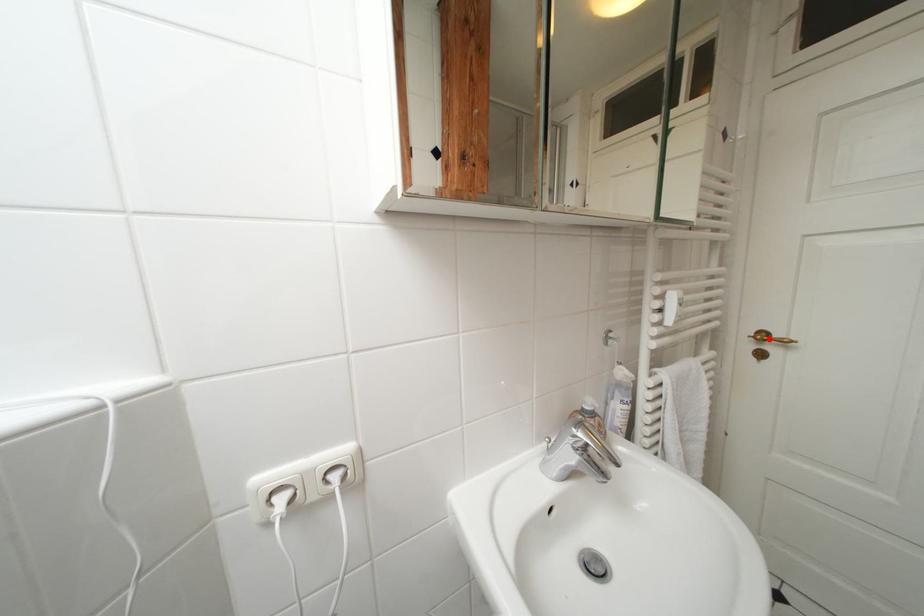
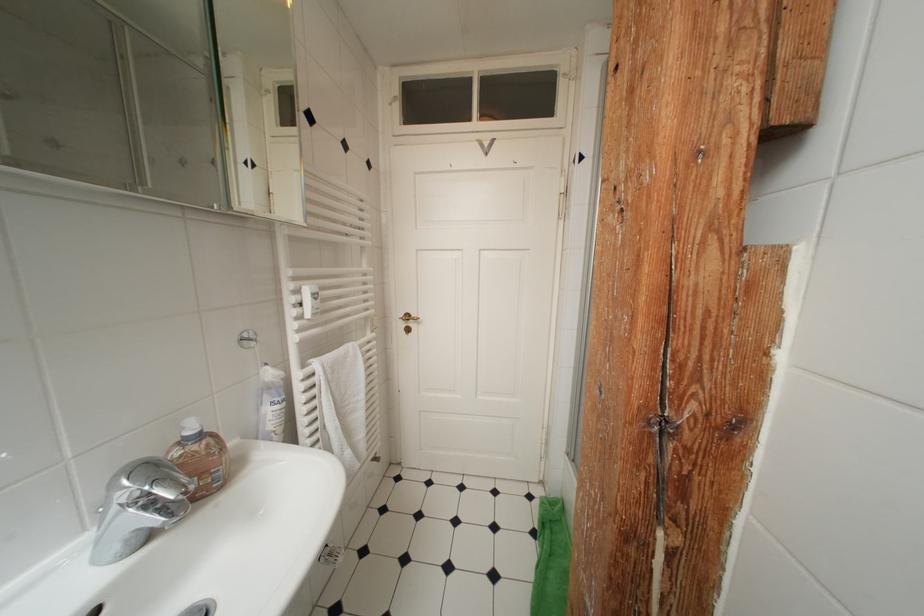
Locate, in the second image, the point that corresponds to the highlighted location in the first image.

(415, 320)